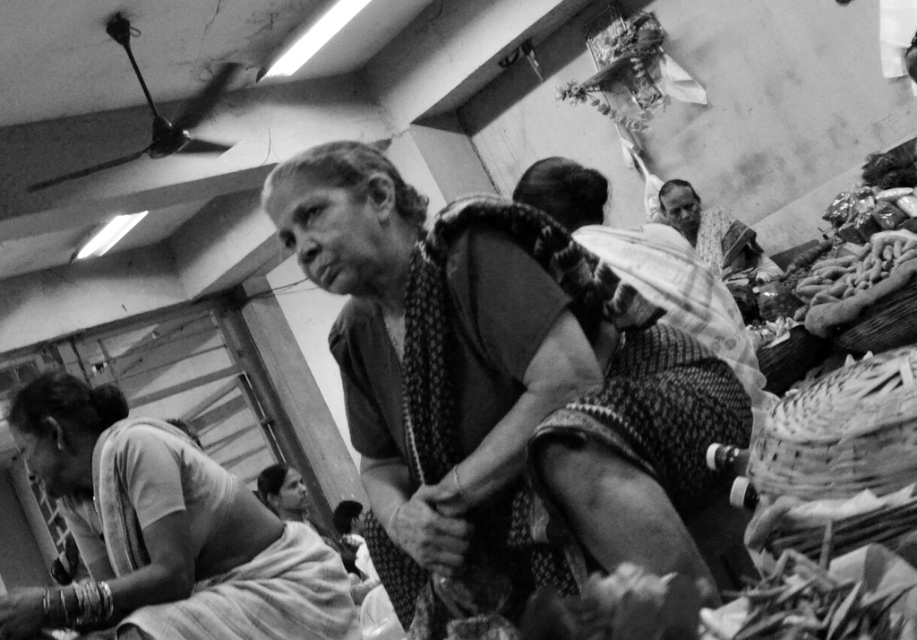
Question: Considering the real-world distances, which object is closest to the patterned fabric saree at center?

Choices:
 (A) patterned fabric man at upper right
 (B) silky white saree at left

Answer: (B)

Question: Which of the following is the farthest from the observer?

Choices:
 (A) patterned fabric saree at center
 (B) silky white saree at left

Answer: (B)

Question: Is silky white saree at left positioned at the back of patterned fabric man at upper right?

Choices:
 (A) yes
 (B) no

Answer: (B)

Question: Can you confirm if patterned fabric saree at center is smaller than silky white saree at left?

Choices:
 (A) yes
 (B) no

Answer: (A)

Question: Does silky white saree at left have a lesser width compared to patterned fabric man at upper right?

Choices:
 (A) no
 (B) yes

Answer: (A)

Question: Which object is farther from the camera taking this photo?

Choices:
 (A) silky white saree at left
 (B) patterned fabric saree at center
 (C) patterned fabric man at upper right

Answer: (C)